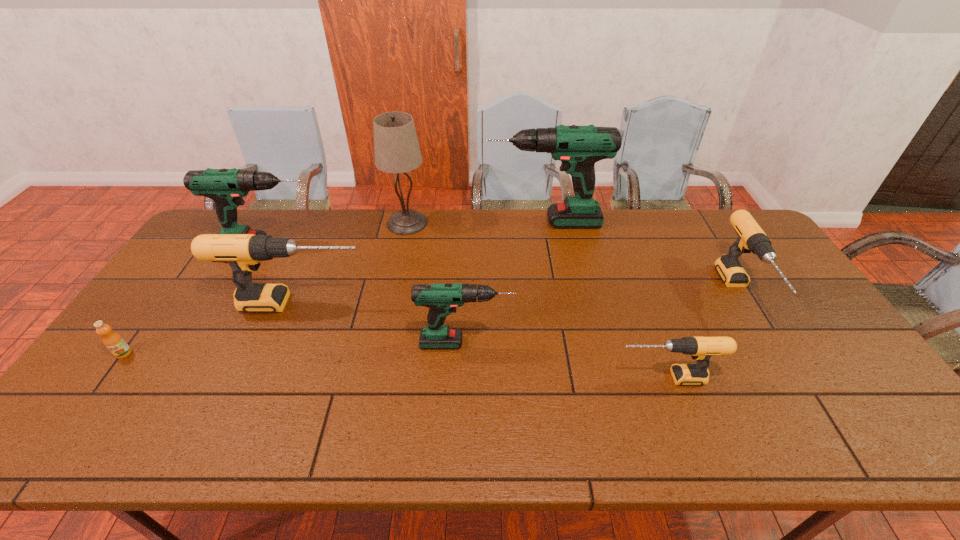
Where is `vacant space at the far edge`? The image size is (960, 540). vacant space at the far edge is located at coordinates (686, 243).

The image size is (960, 540). In the image, there is a desktop. In order to click on free space at the near edge in this screenshot , I will do `click(588, 445)`.

You are a GUI agent. You are given a task and a screenshot of the screen. Output one action in this format:
    pyautogui.click(x=<x>, y=<y>)
    Task: Click on the vacant area at the left edge of the desktop
    The height and width of the screenshot is (540, 960).
    Given the screenshot: What is the action you would take?
    pyautogui.click(x=203, y=299)

In the image, there is a desktop. Where is `free region at the right edge`? Image resolution: width=960 pixels, height=540 pixels. free region at the right edge is located at coordinates (781, 307).

Image resolution: width=960 pixels, height=540 pixels. In order to click on vacant position at the far right corner of the desktop in this screenshot , I will do `click(719, 219)`.

Identify the location of free space between the shortest object and the smallest green drill. This screenshot has height=540, width=960. (295, 348).

Identify the location of blank region between the nearest green drill and the second farthest drill. (368, 294).

Identify the location of free point between the fifth nearest drill and the smallest green drill. (368, 294).

Locate an element on the screen. This screenshot has width=960, height=540. empty location between the leftmost object and the nearest object is located at coordinates (395, 366).

Where is `free spot between the nearest green drill and the farthest green drill`? free spot between the nearest green drill and the farthest green drill is located at coordinates (505, 282).